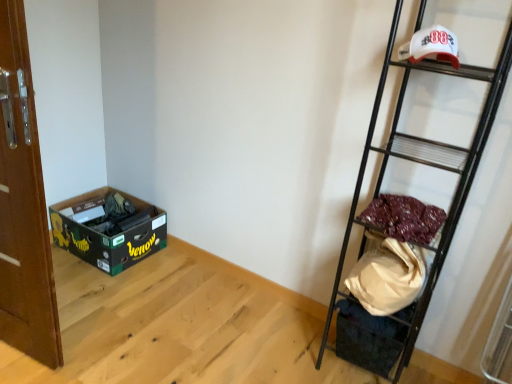
Question: From a real-world perspective, relative to black metal ladder at right, is maroon fabric at right vertically above or below?

Choices:
 (A) below
 (B) above

Answer: (B)

Question: Relative to black metal ladder at right, is maroon fabric at right in front or behind?

Choices:
 (A) front
 (B) behind

Answer: (B)

Question: Which object is positioned closest to the white fabric bag at lower right?

Choices:
 (A) brown wooden door at left
 (B) black metal ladder at right
 (C) white matte baseball cap at upper right
 (D) maroon fabric at right
 (E) green cardboard box at lower left

Answer: (B)

Question: Which of these objects is positioned farthest from the white fabric bag at lower right?

Choices:
 (A) white matte baseball cap at upper right
 (B) maroon fabric at right
 (C) green cardboard box at lower left
 (D) black metal ladder at right
 (E) brown wooden door at left

Answer: (C)